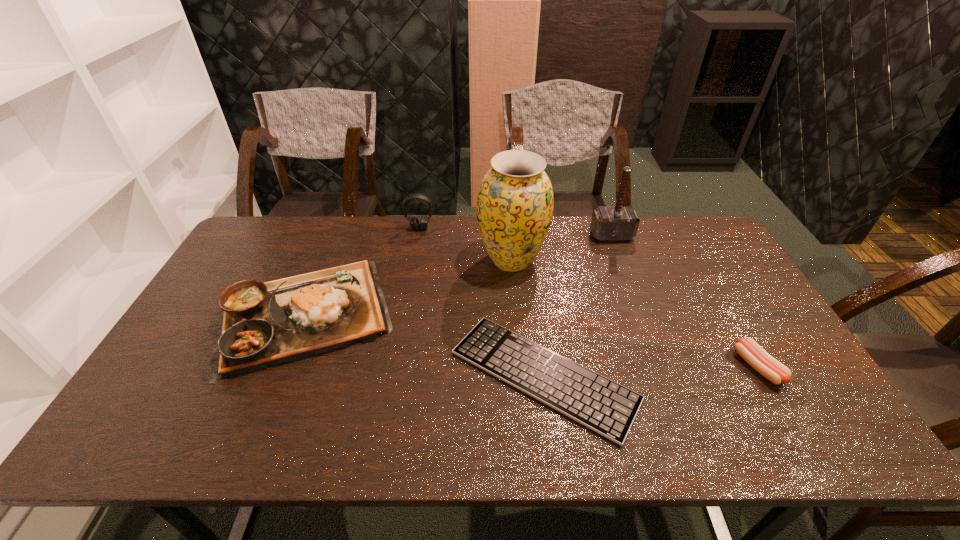
At what (x,y) coordinates should I click in order to perform the action: click on free space between the computer keyboard and the fifth shortest object. Please return your answer as a coordinate pair (x, y). The width and height of the screenshot is (960, 540). Looking at the image, I should click on (578, 306).

Identify the location of vacant space that's between the hammer and the shortest object. The image size is (960, 540). (578, 306).

Find the location of a particular element. The width and height of the screenshot is (960, 540). object that is the fourth closest to the tallest object is located at coordinates pyautogui.click(x=264, y=324).

Locate an element on the screen. object that stands as the fourth closest to the hammer is located at coordinates (414, 222).

Locate an element on the screen. The width and height of the screenshot is (960, 540). vacant point that satisfies the following two spatial constraints: 1. on the front-facing side of the headset; 2. on the left side of the vase is located at coordinates (415, 260).

The image size is (960, 540). I want to click on free space that satisfies the following two spatial constraints: 1. on the front side of the rightmost object; 2. on the left side of the vase, so click(x=520, y=367).

Locate an element on the screen. free spot that satisfies the following two spatial constraints: 1. on the front-facing side of the third tallest object; 2. on the right side of the shortest object is located at coordinates tap(395, 375).

Locate an element on the screen. free spot that satisfies the following two spatial constraints: 1. on the front-facing side of the fifth tallest object; 2. on the left side of the headset is located at coordinates (396, 367).

Locate an element on the screen. The image size is (960, 540). vacant area that satisfies the following two spatial constraints: 1. on the front side of the rightmost object; 2. on the right side of the hammer is located at coordinates (660, 367).